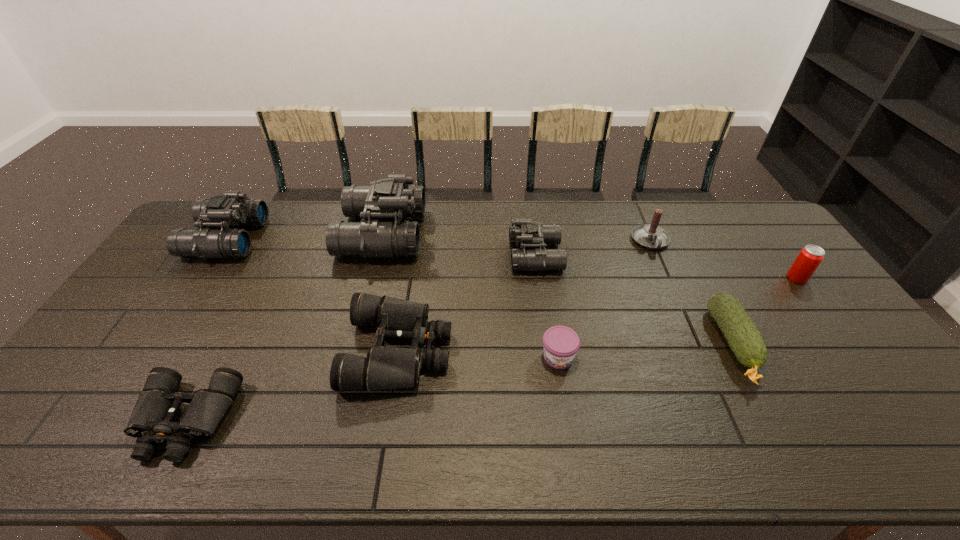
Where is `blank region between the third tallest binoculars and the rightmost object`? The height and width of the screenshot is (540, 960). blank region between the third tallest binoculars and the rightmost object is located at coordinates (666, 267).

Where is `the sixth closest object relative to the second smallest blue binoculars`? The height and width of the screenshot is (540, 960). the sixth closest object relative to the second smallest blue binoculars is located at coordinates (651, 236).

You are a GUI agent. You are given a task and a screenshot of the screen. Output one action in this format:
    pyautogui.click(x=<x>, y=<y>)
    Task: Click on the object that can be found as the sixth closest to the third tallest binoculars
    
    Given the screenshot: What is the action you would take?
    pyautogui.click(x=810, y=257)

The height and width of the screenshot is (540, 960). Identify the location of binoculars that stands as the closest to the red can. (525, 232).

I want to click on binoculars that is the second closest one to the second tallest object, so click(151, 421).

Locate an element on the screen. Image resolution: width=960 pixels, height=540 pixels. blue binoculars that stands as the closest to the tallest binoculars is located at coordinates (232, 209).

Find the location of a particular element. blue binoculars object that ranks as the closest to the tallest object is located at coordinates (232, 209).

Identify the location of free location that satisfies the following two spatial constraints: 1. through the lenses of the second tallest binoculars; 2. on the back side of the can. (201, 278).

Where is `blank space that satisfies the following two spatial constraints: 1. on the side of the candle with the handle loop; 2. through the eyepieces of the sixth tallest object`? The width and height of the screenshot is (960, 540). blank space that satisfies the following two spatial constraints: 1. on the side of the candle with the handle loop; 2. through the eyepieces of the sixth tallest object is located at coordinates (698, 350).